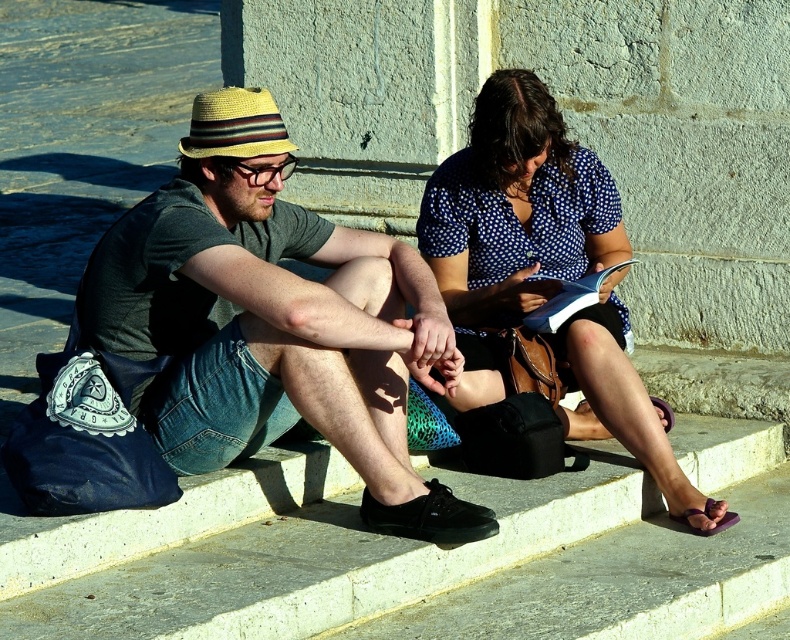
The width and height of the screenshot is (790, 640). Identify the location of blue dotted blouse at upper center. (514, 221).

What are the coordinates of `blue dotted blouse at upper center` in the screenshot? It's located at (514, 221).

Can you confirm if matte black shoes at lower center is bigger than purple fabric sandal at lower right?

Correct, matte black shoes at lower center is larger in size than purple fabric sandal at lower right.

Is point (386, 326) less distant than point (709, 506)?

Yes, point (386, 326) is in front of point (709, 506).

Image resolution: width=790 pixels, height=640 pixels. What do you see at coordinates (262, 308) in the screenshot?
I see `matte black shoes at lower center` at bounding box center [262, 308].

In order to click on matte black shoes at lower center in this screenshot , I will do `click(262, 308)`.

Is point (324, 371) closer to viewer compared to point (484, 99)?

Yes, point (324, 371) is closer to viewer.

Between matte black shoes at lower center and blue dotted blouse at upper center, which one appears on the right side from the viewer's perspective?

Positioned to the right is blue dotted blouse at upper center.

Locate an element on the screen. Image resolution: width=790 pixels, height=640 pixels. matte black shoes at lower center is located at coordinates (262, 308).